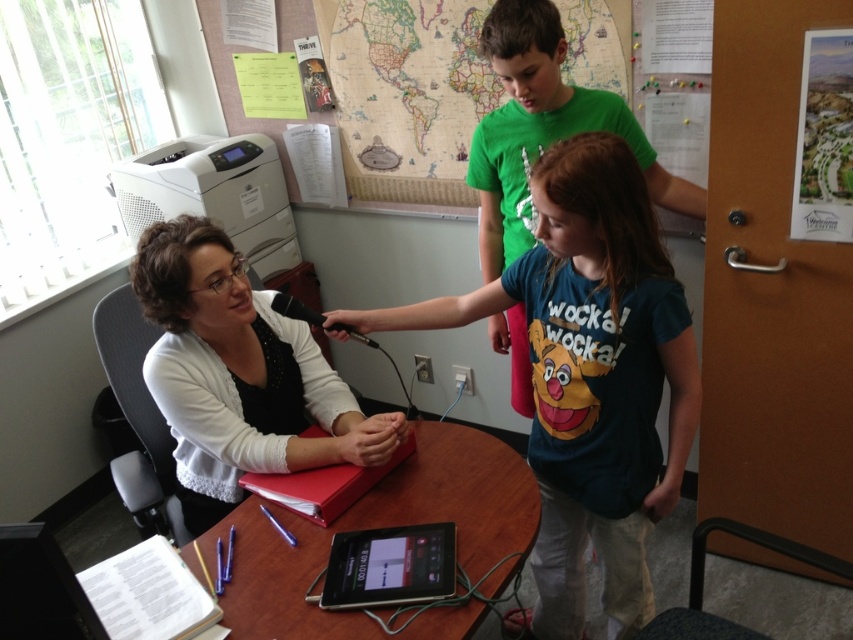
Is point (473, 554) positioned after point (352, 564)?

Yes, it is behind point (352, 564).

Locate an element on the screen. wooden table at center is located at coordinates (381, 525).

I want to click on wooden table at center, so click(x=381, y=525).

Does blue cotton shirt at center appear under white matte shirt at center?

Yes, blue cotton shirt at center is below white matte shirt at center.

Between blue cotton shirt at center and white matte shirt at center, which one has less height?

white matte shirt at center is shorter.

Locate an element on the screen. Image resolution: width=853 pixels, height=640 pixels. blue cotton shirt at center is located at coordinates (589, 374).

Is white matte shirt at center wider than paper map at upper center?

No.

Which is below, white matte shirt at center or paper map at upper center?

white matte shirt at center

Is point (264, 348) behind point (445, 65)?

No.

Find the location of `white matte shirt at center`. white matte shirt at center is located at coordinates (238, 374).